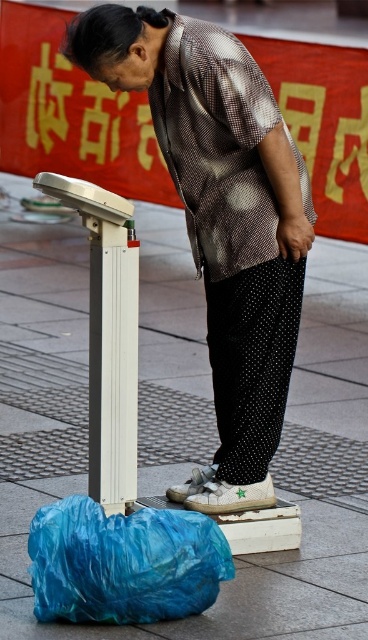
Question: Can you confirm if blue plastic bag at lower left is thinner than white plastic scale at lower left?

Choices:
 (A) no
 (B) yes

Answer: (A)

Question: Among these objects, which one is farthest from the camera?

Choices:
 (A) white metallic scale at lower left
 (B) white tile pavement at center

Answer: (A)

Question: Can you confirm if blue plastic bag at lower left is positioned to the left of white plastic scale at lower left?

Choices:
 (A) yes
 (B) no

Answer: (B)

Question: Which of the following is the farthest from the observer?

Choices:
 (A) blue plastic bag at lower left
 (B) metallic patterned shirt at center
 (C) white plastic scale at lower left
 (D) white metallic scale at lower left

Answer: (D)

Question: Is metallic patterned shirt at center to the right of white plastic scale at lower left from the viewer's perspective?

Choices:
 (A) no
 (B) yes

Answer: (B)

Question: Based on their relative distances, which object is farther from the white plastic scale at lower left?

Choices:
 (A) blue plastic bag at lower left
 (B) white tile pavement at center
 (C) metallic patterned shirt at center
 (D) white metallic scale at lower left

Answer: (B)